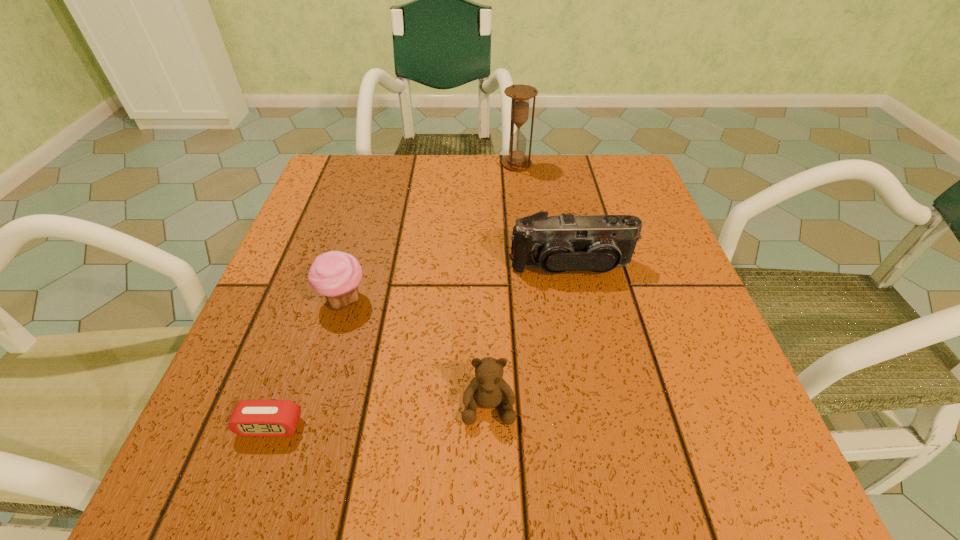
In the image, there is a desktop. Identify the location of blank space at the far right corner. (586, 201).

I want to click on free space at the near right corner of the desktop, so click(660, 496).

You are a GUI agent. You are given a task and a screenshot of the screen. Output one action in this format:
    pyautogui.click(x=<x>, y=<y>)
    Task: Click on the free spot between the cupcake and the alarm clock
    
    Given the screenshot: What is the action you would take?
    pyautogui.click(x=307, y=363)

Where is `vacant space in between the cupcake and the shortest object`? Image resolution: width=960 pixels, height=540 pixels. vacant space in between the cupcake and the shortest object is located at coordinates (307, 363).

Locate an element on the screen. Image resolution: width=960 pixels, height=540 pixels. free point between the third object from right to left and the fourth nearest object is located at coordinates (529, 335).

This screenshot has width=960, height=540. What are the coordinates of `free space between the third object from right to left and the alarm clock` in the screenshot? It's located at (379, 416).

I want to click on unoccupied position between the third object from left to right and the alarm clock, so click(x=379, y=416).

Where is `free space between the farthest object and the alarm clock`? This screenshot has height=540, width=960. free space between the farthest object and the alarm clock is located at coordinates (394, 295).

The image size is (960, 540). What are the coordinates of `free point between the fourth nearest object and the third nearest object` in the screenshot? It's located at (457, 283).

At what (x,y) coordinates should I click in order to perform the action: click on unoccupied position between the fourth nearest object and the alarm clock. Please return your answer as a coordinate pair (x, y). Looking at the image, I should click on (420, 346).